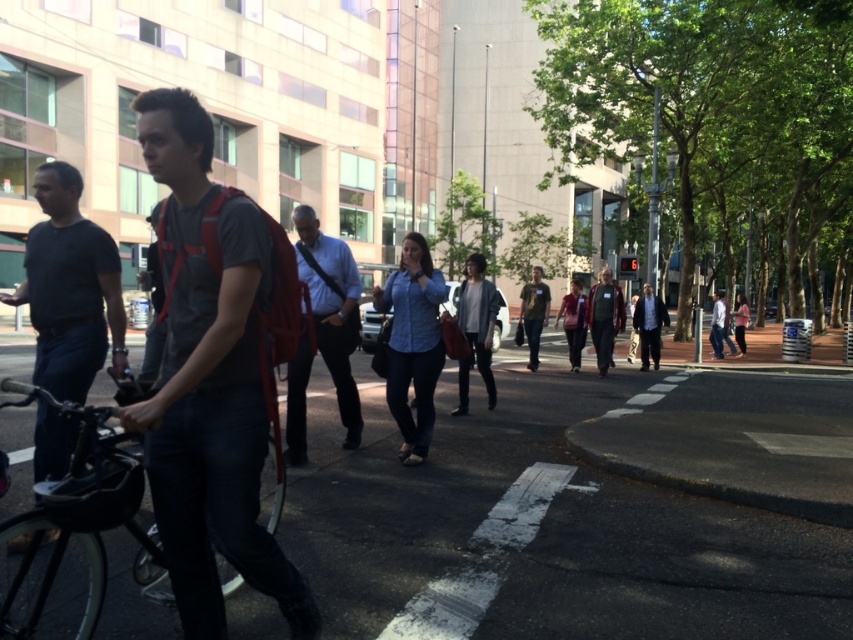
Is dark green fabric jacket at center shorter than white shirt at center?

In fact, dark green fabric jacket at center may be taller than white shirt at center.

Measure the distance between dark green fabric jacket at center and camera.

dark green fabric jacket at center is 13.08 meters away from camera.

Where is `dark green fabric jacket at center`? Image resolution: width=853 pixels, height=640 pixels. dark green fabric jacket at center is located at coordinates (534, 312).

Can you confirm if black matte bicycle at left is smaller than dark gray shirt at left?

Yes.

Which is in front, point (51, 404) or point (36, 305)?

Point (51, 404) is in front.

Locate an element on the screen. The image size is (853, 640). black matte bicycle at left is located at coordinates (78, 518).

Can you confirm if matte gray t-shirt at center is thinner than matte pink jacket at center?

Yes, matte gray t-shirt at center is thinner than matte pink jacket at center.

Does point (207, 353) lie in front of point (572, 342)?

Yes, it is in front of point (572, 342).

Between point (207, 228) and point (577, 298), which one is positioned behind?

The point (577, 298) is behind.

Find the location of a particular element. This screenshot has height=640, width=853. matte gray t-shirt at center is located at coordinates (210, 378).